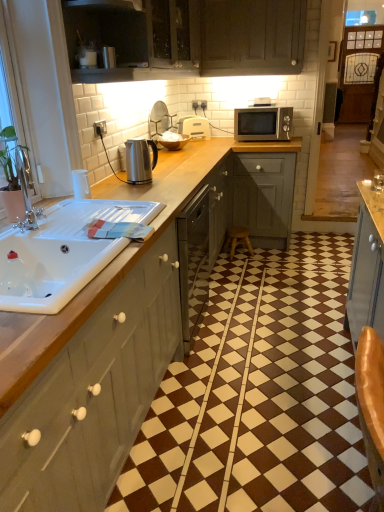
Question: From the image's perspective, is satin silver kettle at center, which is counted as the third appliance, starting from the top, beneath matte wood cabinet at upper center, the 2th cabinetry from the top?

Choices:
 (A) yes
 (B) no

Answer: (A)

Question: Does satin silver kettle at center, which is counted as the third appliance, starting from the top, have a lesser height compared to matte wood cabinet at upper center, positioned as the second cabinetry in bottom-to-top order?

Choices:
 (A) yes
 (B) no

Answer: (A)

Question: Considering the relative positions of satin silver kettle at center, arranged as the first appliance when viewed from the front, and matte wood cabinet at upper center, positioned as the second cabinetry in bottom-to-top order, in the image provided, is satin silver kettle at center, arranged as the first appliance when viewed from the front, to the left of matte wood cabinet at upper center, positioned as the second cabinetry in bottom-to-top order, from the viewer's perspective?

Choices:
 (A) yes
 (B) no

Answer: (A)

Question: Does satin silver kettle at center, placed as the first appliance when sorted from bottom to top, have a lesser width compared to matte wood cabinet at upper center, positioned as the second cabinetry in bottom-to-top order?

Choices:
 (A) no
 (B) yes

Answer: (B)

Question: Can you confirm if satin silver kettle at center, placed as the first appliance when sorted from bottom to top, is taller than matte wood cabinet at upper center, positioned as the second cabinetry in bottom-to-top order?

Choices:
 (A) yes
 (B) no

Answer: (B)

Question: In terms of width, does wooden stool at center look wider or thinner when compared to satin silver kettle at upper center, placed as the second appliance when sorted from bottom to top?

Choices:
 (A) thin
 (B) wide

Answer: (A)

Question: From a real-world perspective, is wooden stool at center physically located above or below satin silver kettle at upper center, the second appliance viewed from the front?

Choices:
 (A) below
 (B) above

Answer: (A)

Question: Is wooden stool at center to the left or to the right of satin silver kettle at upper center, the 2th appliance viewed from the back, in the image?

Choices:
 (A) left
 (B) right

Answer: (B)

Question: In the image, is wooden stool at center positioned in front of or behind satin silver kettle at upper center, the 2th appliance viewed from the back?

Choices:
 (A) behind
 (B) front

Answer: (A)

Question: Relative to white glossy sink at left, is white plastic toaster at center, the first appliance viewed from the back, in front or behind?

Choices:
 (A) behind
 (B) front

Answer: (A)

Question: In terms of width, does white plastic toaster at center, which is the third appliance from bottom to top, look wider or thinner when compared to white glossy sink at left?

Choices:
 (A) thin
 (B) wide

Answer: (A)

Question: From a real-world perspective, is white plastic toaster at center, the first appliance viewed from the back, positioned above or below white glossy sink at left?

Choices:
 (A) above
 (B) below

Answer: (A)

Question: Is white plastic toaster at center, the first appliance viewed from the back, spatially inside white glossy sink at left, or outside of it?

Choices:
 (A) outside
 (B) inside

Answer: (A)

Question: Is matte wood cabinet at upper center, positioned as the second cabinetry in bottom-to-top order, inside or outside of white glossy sink at left?

Choices:
 (A) inside
 (B) outside

Answer: (B)

Question: Is point coord(137,53) positioned closer to the camera than point coord(86,212)?

Choices:
 (A) farther
 (B) closer

Answer: (A)